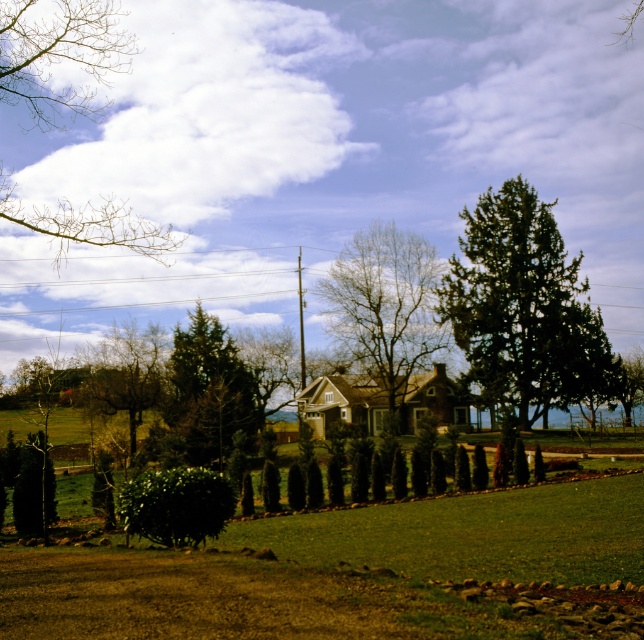
Does bare wood tree at center have a smaller size compared to green textured hedge at center?

Actually, bare wood tree at center might be larger than green textured hedge at center.

Which of these two, bare wood tree at center or green textured hedge at center, stands shorter?

Standing shorter between the two is green textured hedge at center.

Find the location of `bare wood tree at center`. bare wood tree at center is located at coordinates (384, 304).

Is green textured evergreen tree at center in front of green leafy hedge at center?

A: No, it is behind green leafy hedge at center.

The width and height of the screenshot is (644, 640). Find the location of `green textured evergreen tree at center`. green textured evergreen tree at center is located at coordinates (207, 388).

Consider the image. Does green textured hedge at lower left come in front of green textured hedge at center?

Yes, it is.

Is green textured hedge at lower left to the left of green textured hedge at center from the viewer's perspective?

Yes, green textured hedge at lower left is to the left of green textured hedge at center.

Does point (32, 464) come in front of point (355, 499)?

Yes, point (32, 464) is in front of point (355, 499).

Locate an element on the screen. This screenshot has width=644, height=640. green textured hedge at lower left is located at coordinates (30, 483).